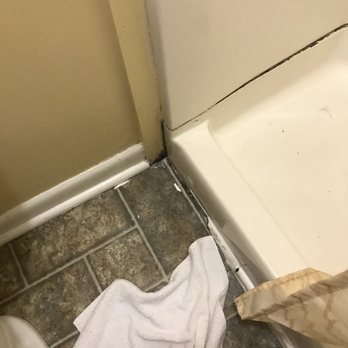
This screenshot has height=348, width=348. Identify the location of walk-in shower. (284, 168).